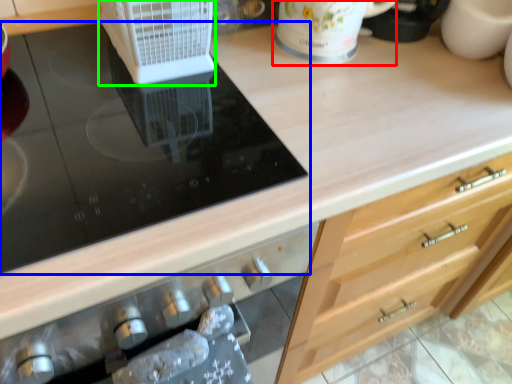
Question: Which is nearer to the mug (highlighted by a red box)? gas stove (highlighted by a blue box) or kitchen appliance (highlighted by a green box).

Choices:
 (A) gas stove
 (B) kitchen appliance

Answer: (B)